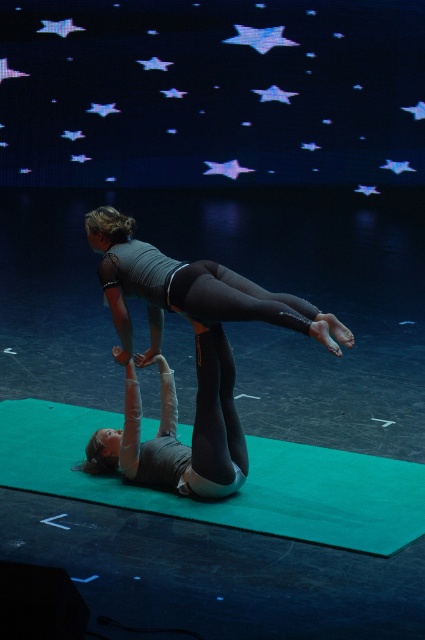
Is green rubber yoga mat at center to the right of matte black gymnast at upper center from the viewer's perspective?

In fact, green rubber yoga mat at center is to the left of matte black gymnast at upper center.

Between point (261, 513) and point (201, 305), which one is positioned behind?

Positioned behind is point (201, 305).

The width and height of the screenshot is (425, 640). I want to click on green rubber yoga mat at center, so click(240, 490).